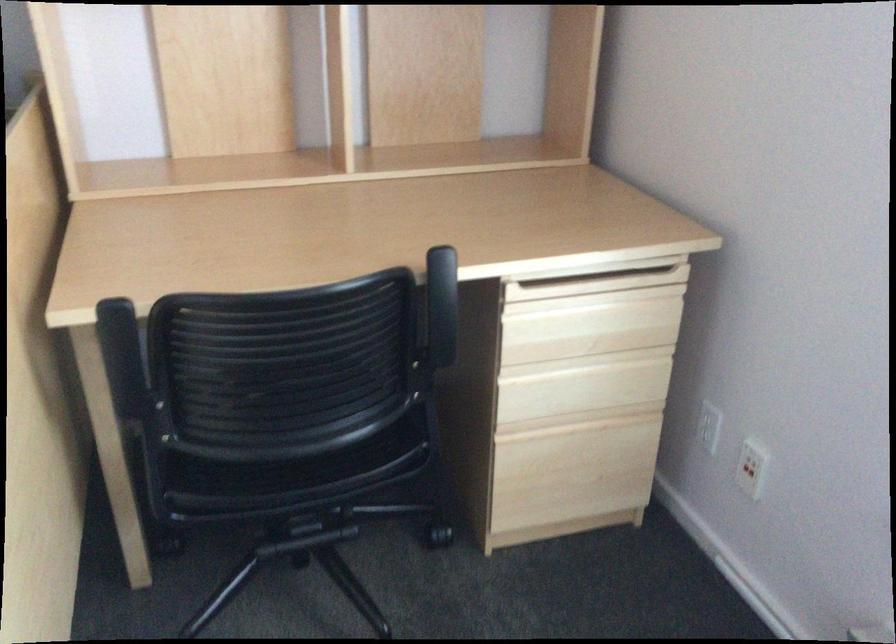
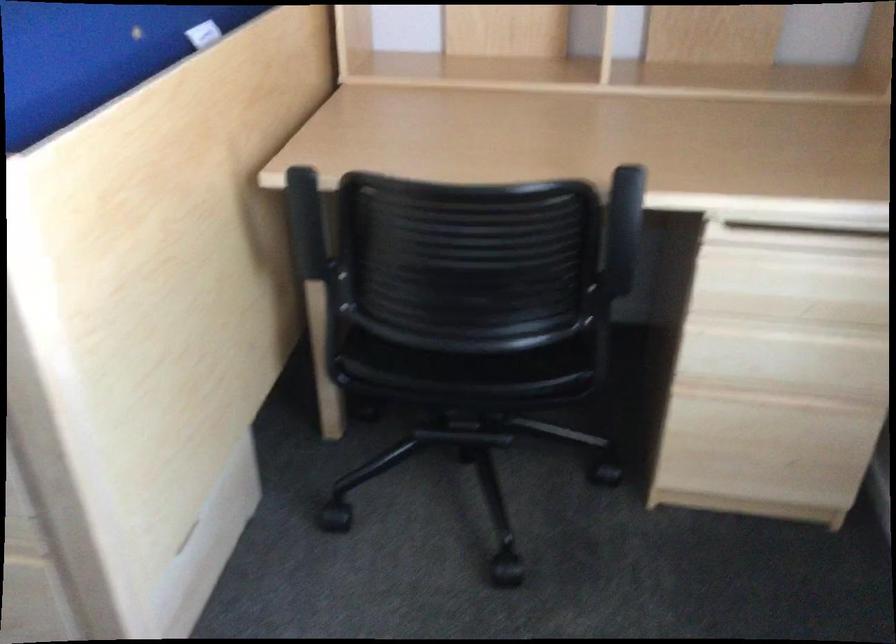
Locate, in the second image, the point that corresponds to [444,312] in the first image.

(625, 240)